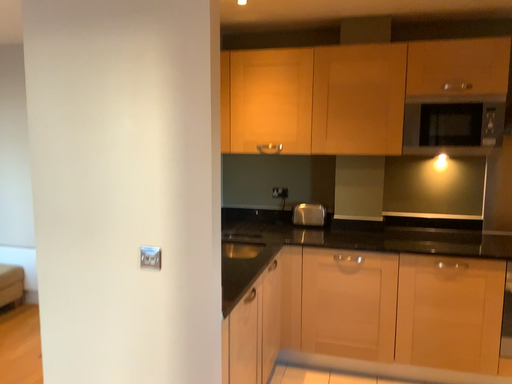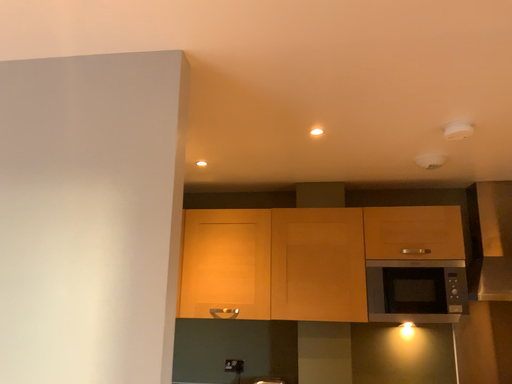
Question: Which way did the camera rotate in the video?

Choices:
 (A) rotated downward
 (B) rotated upward

Answer: (B)